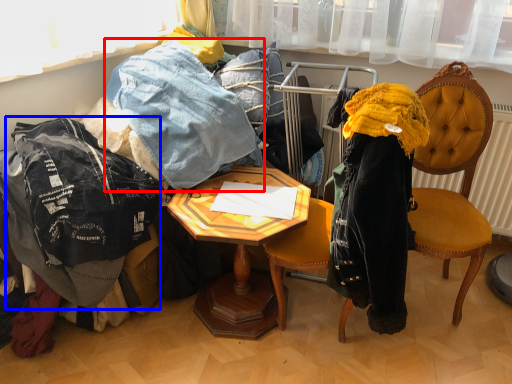
Question: Which of the following is the closest to the observer, trousers (highlighted by a red box) or clothing (highlighted by a blue box)?

Choices:
 (A) trousers
 (B) clothing

Answer: (B)